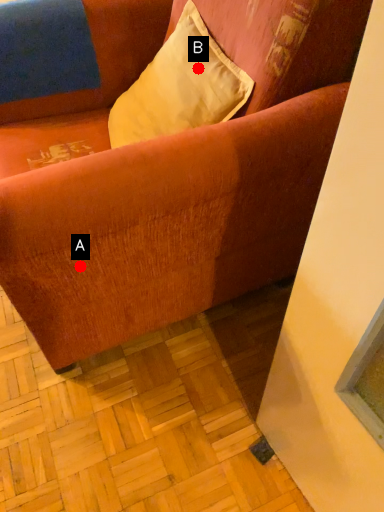
Question: Two points are circled on the image, labeled by A and B beside each circle. Which point is further to the camera?

Choices:
 (A) A is further
 (B) B is further

Answer: (B)